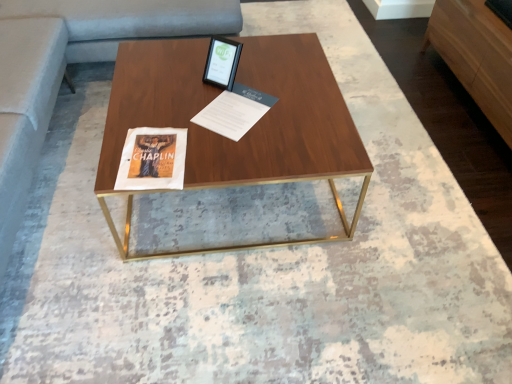
Where is `unoccupied area behind matte black tablet at upper center`? This screenshot has height=384, width=512. unoccupied area behind matte black tablet at upper center is located at coordinates (237, 56).